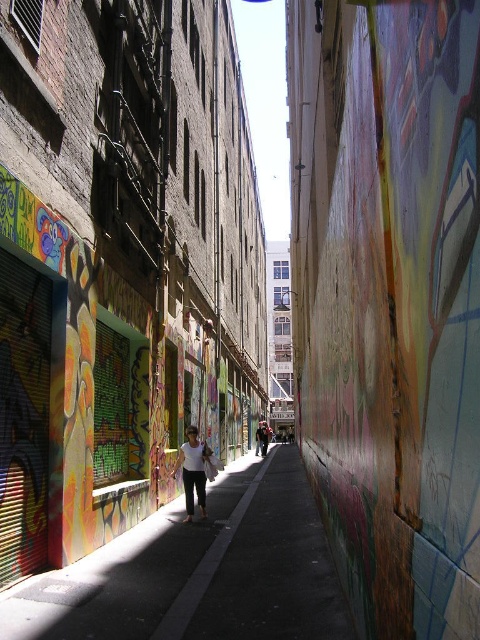
You are a delivery person carrying a package and need to walk through the narrow alleyway. The alley has a dark asphalt pavement at center and a white matte tank top at center. Which path should you choose to ensure you have enough space for your delivery cart?

The dark asphalt pavement at center has a larger width than the white matte tank top at center, so you should choose the dark asphalt pavement at center to ensure enough space for your delivery cart.

You are standing at the entrance of the alleyway and see the point marked at coordinates (200,570). Based on the scene description, where exactly is this point located?

The point is located on the dark asphalt pavement at the center of the alleyway.

You are walking through the alley and want to place your white matte tank top at center on the ground. Will the dark asphalt pavement at center be able to fully cover the tank top when placed there?

Answer: The dark asphalt pavement at center is larger in size than the white matte tank top at center, so yes, the pavement can fully cover the tank top when placed there.